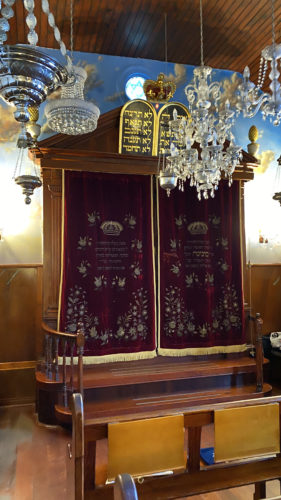
Find the location of a particular element. light fixtures is located at coordinates (31, 64), (207, 122), (272, 75), (61, 105).